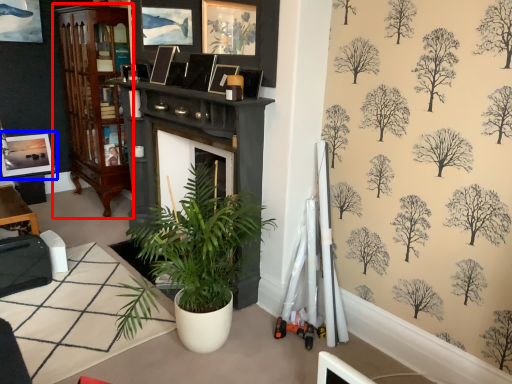
Question: Among these objects, which one is nearest to the camera, cabinetry (highlighted by a red box) or picture frame (highlighted by a blue box)?

Choices:
 (A) cabinetry
 (B) picture frame

Answer: (A)